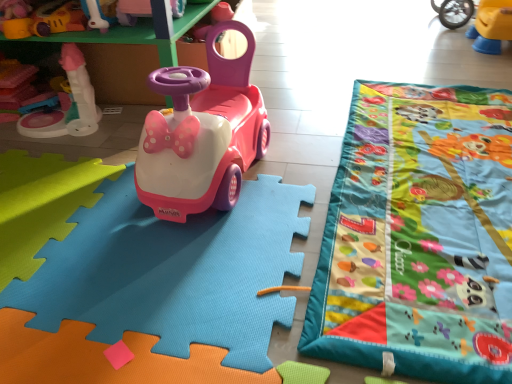
Question: Would you say pink plastic toy car at center is a long distance from matte plastic toy at left, the fourth toy when ordered from top to bottom?

Choices:
 (A) yes
 (B) no

Answer: (B)

Question: Is pink plastic toy car at center positioned before matte plastic toy at left, placed as the 2th toy when sorted from bottom to top?

Choices:
 (A) yes
 (B) no

Answer: (A)

Question: Is matte plastic toy at left, the fourth toy when ordered from top to bottom, located within pink plastic toy car at center?

Choices:
 (A) no
 (B) yes

Answer: (A)

Question: Does pink plastic toy car at center appear on the right side of matte plastic toy at left, placed as the 2th toy when sorted from bottom to top?

Choices:
 (A) yes
 (B) no

Answer: (A)

Question: Is pink plastic toy car at center next to matte plastic toy at left, placed as the 2th toy when sorted from bottom to top, and touching it?

Choices:
 (A) yes
 (B) no

Answer: (B)

Question: From a real-world perspective, is pink plastic toy car at center located higher than matte plastic toy at left, placed as the 2th toy when sorted from bottom to top?

Choices:
 (A) no
 (B) yes

Answer: (B)

Question: Is pink plastic car at center, the 1th toy ordered from the bottom, closer to camera compared to pink plastic toy car at center, the 1th toy viewed from the top?

Choices:
 (A) no
 (B) yes

Answer: (B)

Question: Can you confirm if pink plastic car at center, which is the 5th toy in top-to-bottom order, is positioned to the right of pink plastic toy car at center, the 1th toy viewed from the top?

Choices:
 (A) yes
 (B) no

Answer: (A)

Question: Is pink plastic car at center, which is the 5th toy in top-to-bottom order, located outside pink plastic toy car at center, arranged as the fifth toy when ordered from the bottom?

Choices:
 (A) no
 (B) yes

Answer: (B)

Question: Is pink plastic car at center, the 1th toy ordered from the bottom, thinner than pink plastic toy car at center, arranged as the fifth toy when ordered from the bottom?

Choices:
 (A) yes
 (B) no

Answer: (B)

Question: Is pink plastic toy car at center, the 1th toy viewed from the top, inside pink plastic car at center, the 1th toy ordered from the bottom?

Choices:
 (A) yes
 (B) no

Answer: (B)

Question: Considering the relative positions of pink plastic car at center, which is the 5th toy in top-to-bottom order, and pink plastic toy car at center, arranged as the fifth toy when ordered from the bottom, in the image provided, is pink plastic car at center, which is the 5th toy in top-to-bottom order, behind pink plastic toy car at center, arranged as the fifth toy when ordered from the bottom,?

Choices:
 (A) no
 (B) yes

Answer: (A)

Question: From a real-world perspective, does pink plastic car at center, which is the 5th toy in top-to-bottom order, sit lower than matte plastic toy at upper left, acting as the 3th toy starting from the bottom?

Choices:
 (A) yes
 (B) no

Answer: (A)